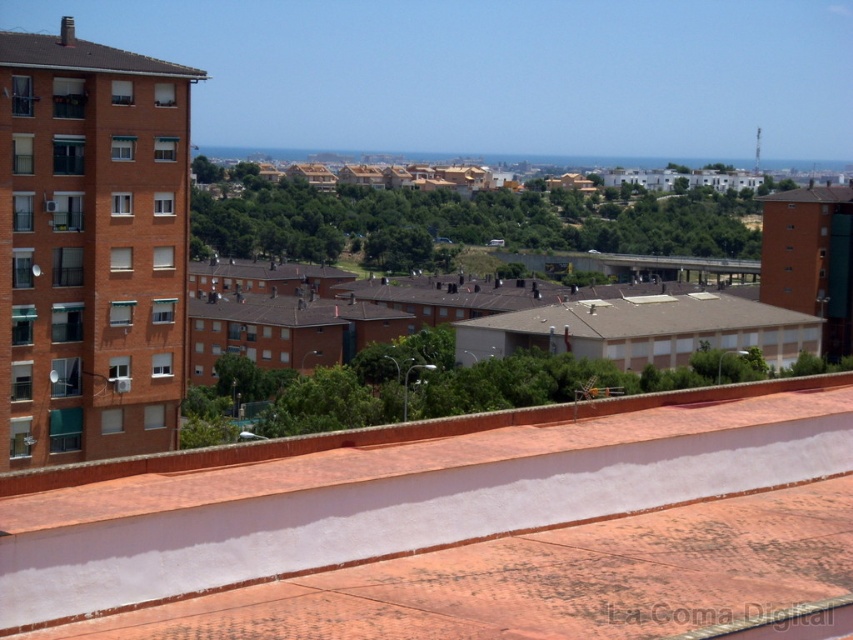
You are a drone operator tasked with capturing aerial footage of the residential area. You need to ensure the camera can capture both the brown tiled roof at upper left and the brown tile roof at upper right in a single frame. Which roof should you position the camera closer to, and why?

You should position the camera closer to the brown tiled roof at upper left because its width is less than the brown tile roof at upper right, so capturing both would require focusing on the narrower one to ensure both fit in the frame.